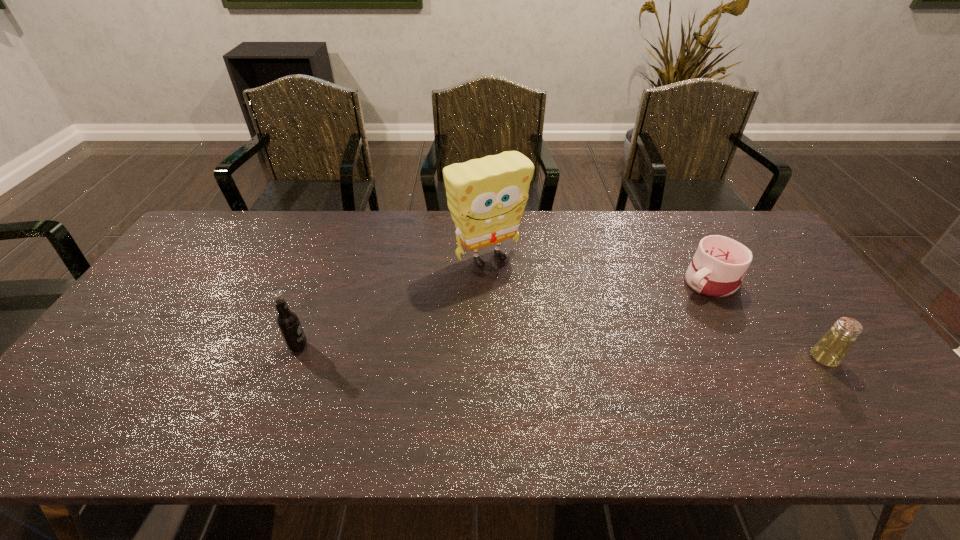
Where is `object that stands as the third closest to the tallest object`? object that stands as the third closest to the tallest object is located at coordinates (830, 350).

You are a GUI agent. You are given a task and a screenshot of the screen. Output one action in this format:
    pyautogui.click(x=<x>, y=<y>)
    Task: Click on the object that is the second closest to the root beer
    The height and width of the screenshot is (540, 960).
    Given the screenshot: What is the action you would take?
    pyautogui.click(x=719, y=265)

Locate an element on the screen. This screenshot has height=540, width=960. vacant space that satisfies the following two spatial constraints: 1. on the front side of the sponge; 2. on the right side of the rightmost object is located at coordinates (490, 358).